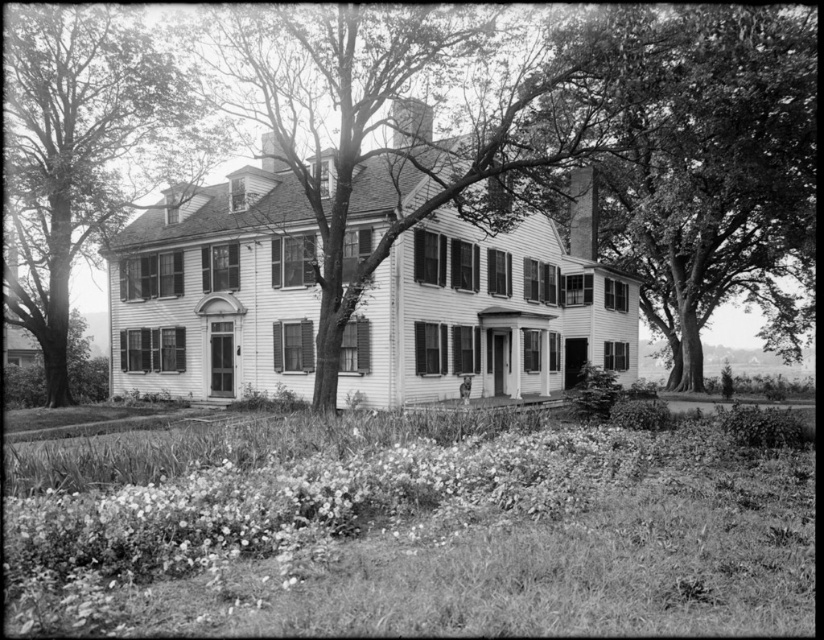
You are standing in front of the two story colonial house and want to walk towards the smooth bark tree at center and the smooth bark tree at left. Which tree will you reach first?

The smooth bark tree at center is closer to the viewer than the smooth bark tree at left, so you will reach the smooth bark tree at center first.

You are standing in the garden of the colonial house and see the smooth bark tree at center and the smooth bark tree at left. Which tree is closer to the ground?

The smooth bark tree at center is closer to the ground because it is below the smooth bark tree at left.